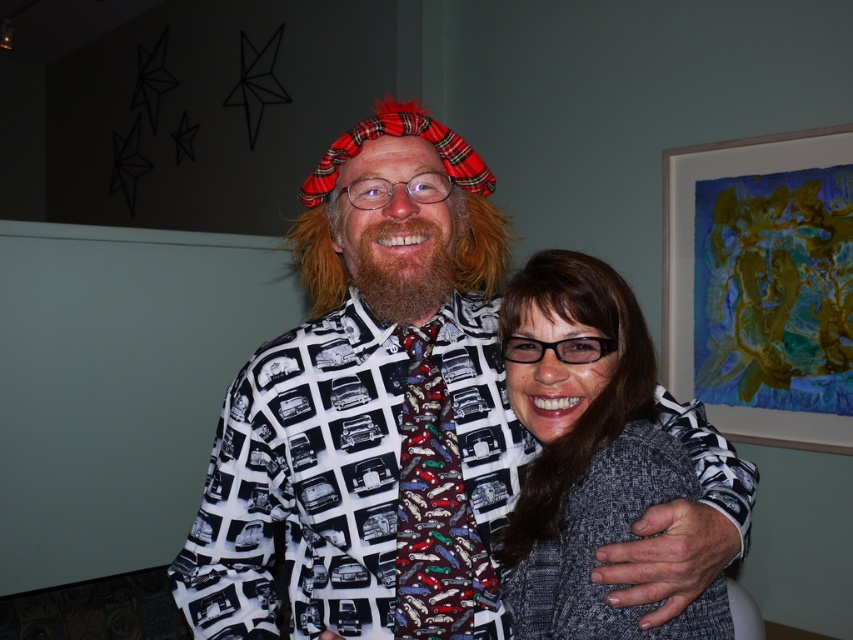
You are standing in the room and want to take a photo of the printed fabric shirt at center. Where should you aim your camera to capture it?

The printed fabric shirt at center is located at the 2D coordinates point (367, 426), so aim your camera there to capture it.